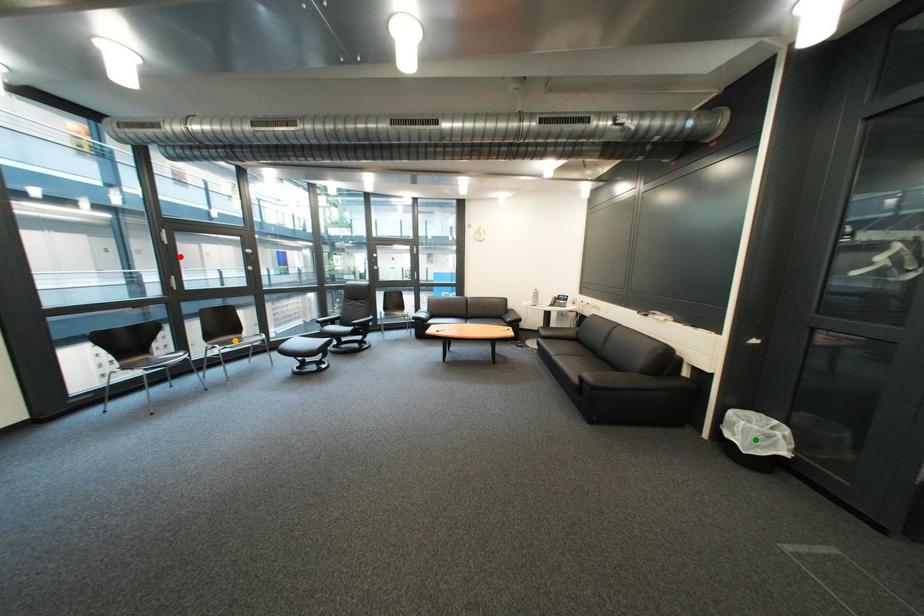
Order these from nearest to farthest:
red point
orange point
green point

red point, orange point, green point